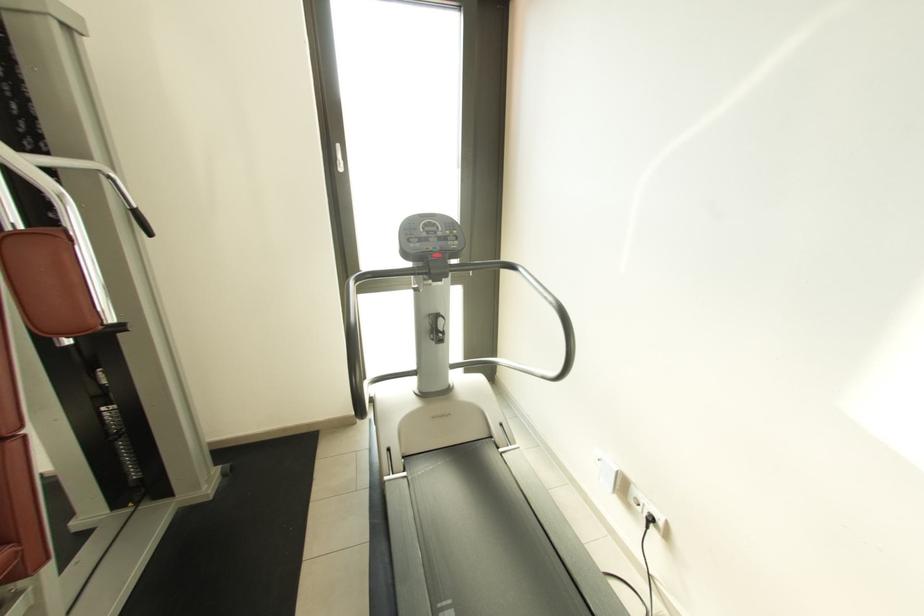
What do you see at coordinates (430, 237) in the screenshot?
I see `the machine control buttons` at bounding box center [430, 237].